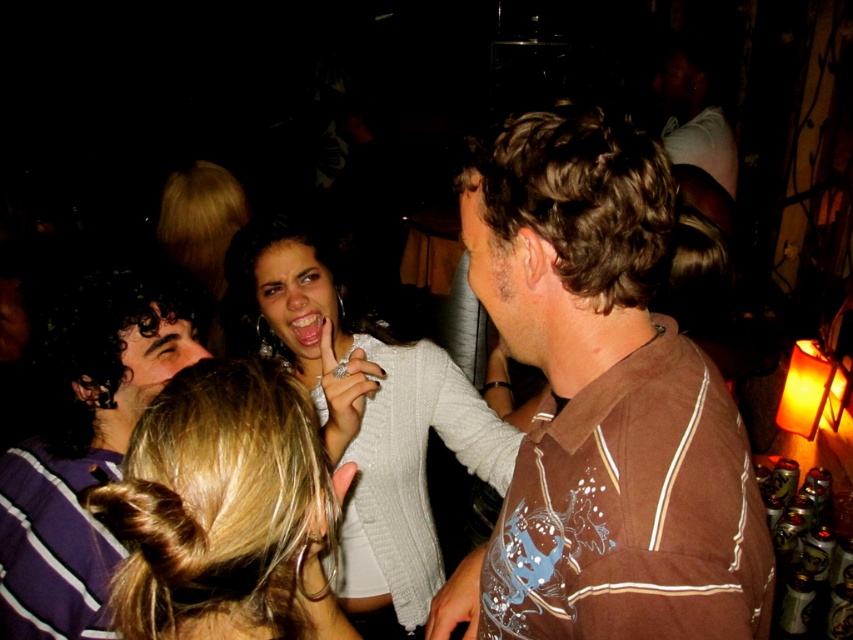
Question: From the image, what is the correct spatial relationship of blonde hair at center in relation to white knitted sweater at center?

Choices:
 (A) below
 (B) above

Answer: (B)

Question: Which object appears closest to the camera in this image?

Choices:
 (A) white knitted sweater at center
 (B) brown striped shirt at center

Answer: (B)

Question: Does brown striped shirt at center appear under white knitted sweater at center?

Choices:
 (A) no
 (B) yes

Answer: (A)

Question: Which is farther from the blonde hair at center?

Choices:
 (A) purple striped shirt at left
 (B) brown striped shirt at center
 (C) white knitted sweater at center

Answer: (C)

Question: Considering the real-world distances, which object is closest to the blonde hair at center?

Choices:
 (A) brown striped shirt at center
 (B) white knitted sweater at center

Answer: (A)

Question: Does brown striped shirt at center appear on the right side of purple striped shirt at left?

Choices:
 (A) yes
 (B) no

Answer: (A)